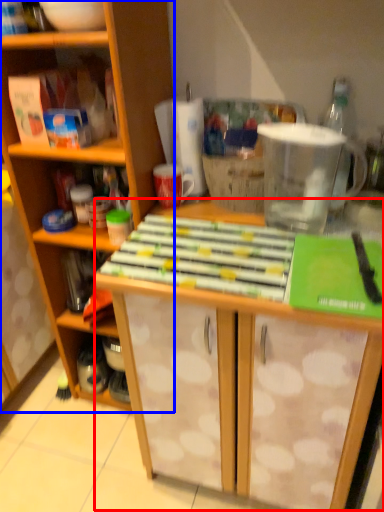
Question: Which object is closer to the camera taking this photo, table (highlighted by a red box) or cabinetry (highlighted by a blue box)?

Choices:
 (A) table
 (B) cabinetry

Answer: (A)